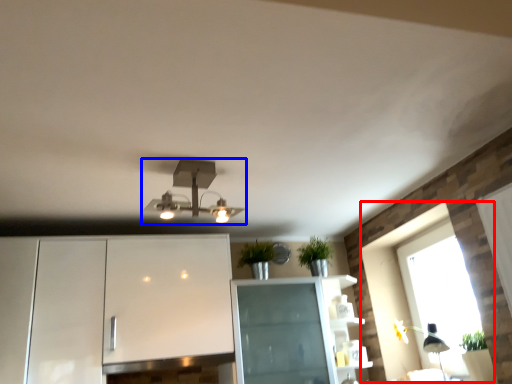
Question: Among these objects, which one is nearest to the camera, window (highlighted by a red box) or lamp (highlighted by a blue box)?

Choices:
 (A) window
 (B) lamp

Answer: (B)